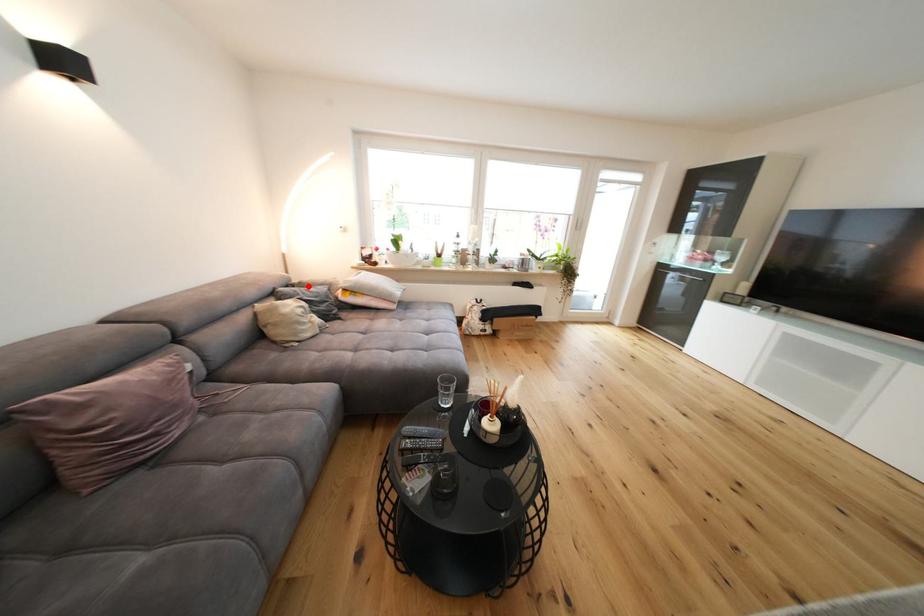
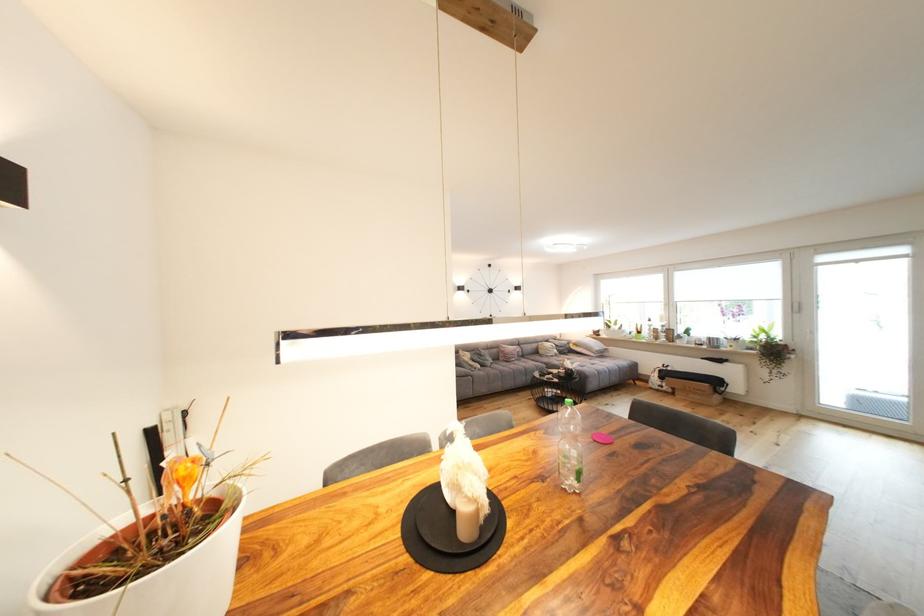
Question: I am providing you with two images of the same scene from different viewpoints. Given a red point in image1, look at the same physical point in image2. Is it:

Choices:
 (A) Closer to the viewpoint
 (B) Farther from the viewpoint

Answer: (B)